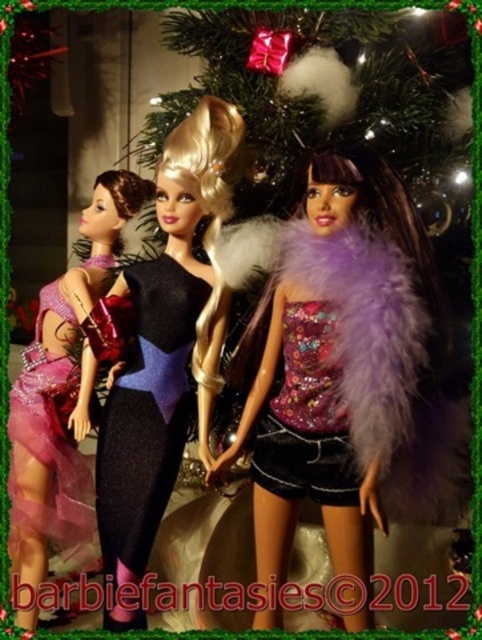
You are organizing a doll display and need to ensure that the purple sequined top at center and the matte pink tulle dress at left fit on a shelf that can only accommodate items up to the width of the wider of the two. Which doll should you place first to maximize space?

The purple sequined top at center has a larger width than the matte pink tulle dress at left, so you should place the purple sequined top at center first to accommodate its wider size.